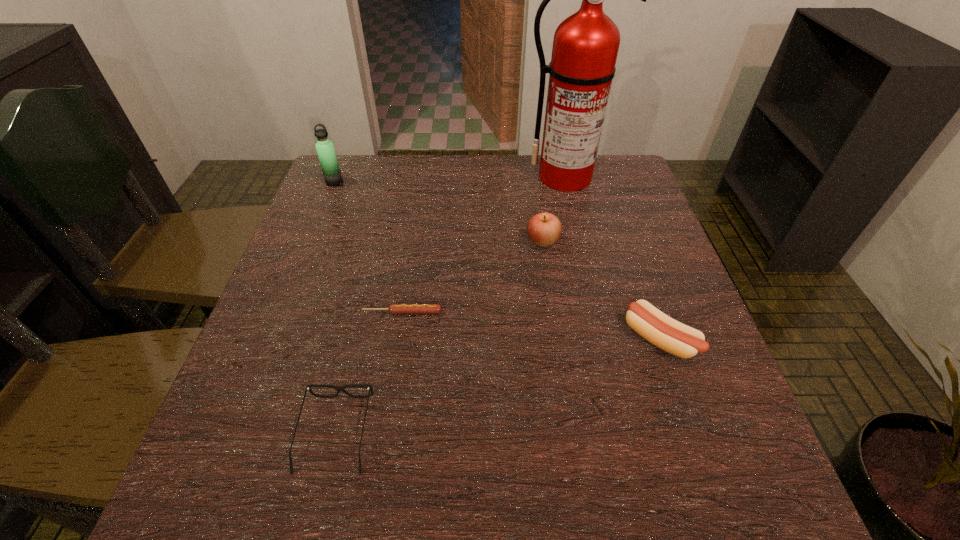
The height and width of the screenshot is (540, 960). In order to click on spectacles situated at the left edge in this screenshot , I will do `click(308, 387)`.

Identify the location of fire extinguisher present at the right edge. (585, 46).

This screenshot has height=540, width=960. In order to click on sausage positioned at the right edge in this screenshot , I will do `click(670, 335)`.

Identify the location of object present at the far left corner. (325, 149).

Locate an element on the screen. Image resolution: width=960 pixels, height=540 pixels. object present at the near left corner is located at coordinates (308, 387).

Find the location of a particular element. object that is at the far right corner is located at coordinates (585, 46).

In the image, there is a desktop. Where is `vacant region at the far edge`? vacant region at the far edge is located at coordinates (397, 166).

This screenshot has width=960, height=540. In the image, there is a desktop. Identify the location of vacant area at the near edge. (468, 457).

At what (x,y) coordinates should I click in order to perform the action: click on vacant space at the left edge. Please return your answer as a coordinate pair (x, y). Looking at the image, I should click on (288, 312).

This screenshot has height=540, width=960. Identify the location of vacant space at the right edge of the desktop. (655, 222).